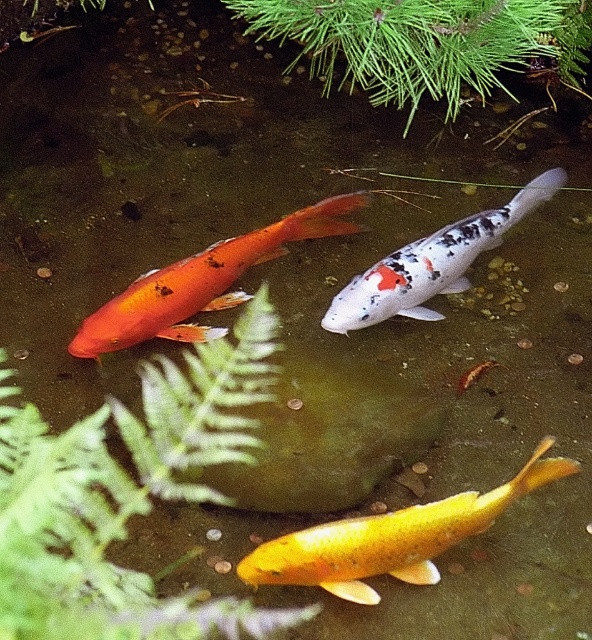
I want to click on green leafy fern at upper left, so click(127, 497).

Which is above, green leafy fern at upper left or white speckled fish at center?

white speckled fish at center is higher up.

Where is `green leafy fern at upper left`? The width and height of the screenshot is (592, 640). green leafy fern at upper left is located at coordinates (127, 497).

What do you see at coordinates (391, 538) in the screenshot? The width and height of the screenshot is (592, 640). I see `shiny gold fish at center` at bounding box center [391, 538].

Who is more distant from viewer, (304, 550) or (355, 275)?

The point (355, 275) is behind.

The height and width of the screenshot is (640, 592). I want to click on shiny gold fish at center, so click(x=391, y=538).

The width and height of the screenshot is (592, 640). Find the location of `shiny gold fish at center`. shiny gold fish at center is located at coordinates (391, 538).

Looking at this image, can you confirm if green needle-like leaves at upper center is positioned to the right of shiny gold fish at center?

Incorrect, green needle-like leaves at upper center is not on the right side of shiny gold fish at center.

Between point (429, 70) and point (411, 541), which one is positioned in front?

Point (411, 541) is more forward.

Find the location of `green needle-like leaves at upper center`. green needle-like leaves at upper center is located at coordinates (424, 42).